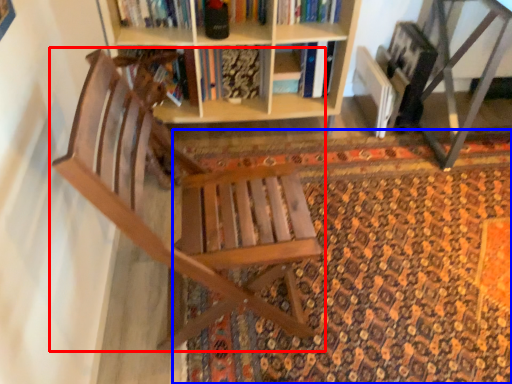
Question: Which point is closer to the camera, chair (highlighted by a red box) or doormat (highlighted by a blue box)?

Choices:
 (A) chair
 (B) doormat

Answer: (A)